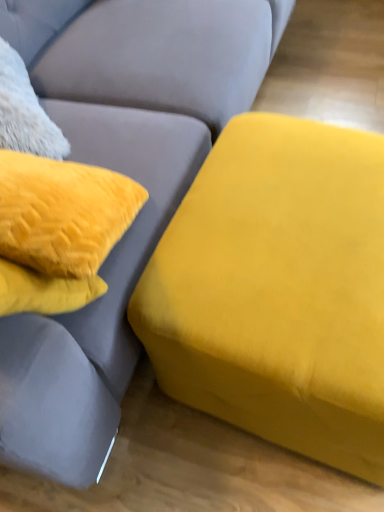
What do you see at coordinates (277, 290) in the screenshot?
I see `velvet yellow ottoman at right, positioned as the 1th studio couch in bottom-to-top order` at bounding box center [277, 290].

This screenshot has width=384, height=512. I want to click on velvet yellow ottoman at right, positioned as the 1th studio couch in bottom-to-top order, so click(x=277, y=290).

What do you see at coordinates (125, 174) in the screenshot? The height and width of the screenshot is (512, 384). I see `velvet yellow ottoman at right, marked as the 2th studio couch in a bottom-to-top arrangement` at bounding box center [125, 174].

Identify the location of velvet yellow ottoman at right, marked as the 2th studio couch in a bottom-to-top arrangement. (125, 174).

Where is `velvet yellow ottoman at right, which is the 2th studio couch in top-to-bottom order`? This screenshot has height=512, width=384. velvet yellow ottoman at right, which is the 2th studio couch in top-to-bottom order is located at coordinates (277, 290).

Between velvet yellow ottoman at right, marked as the 2th studio couch in a bottom-to-top arrangement, and velvet yellow ottoman at right, positioned as the 1th studio couch in bottom-to-top order, which one appears on the left side from the viewer's perspective?

From the viewer's perspective, velvet yellow ottoman at right, marked as the 2th studio couch in a bottom-to-top arrangement, appears more on the left side.

Who is more distant, velvet yellow ottoman at right, placed as the 1th studio couch when sorted from top to bottom, or velvet yellow ottoman at right, positioned as the 1th studio couch in bottom-to-top order?

velvet yellow ottoman at right, positioned as the 1th studio couch in bottom-to-top order, is further from the camera.

Is point (158, 186) more distant than point (265, 121)?

No, (158, 186) is closer to viewer.

From the image's perspective, is velvet yellow ottoman at right, marked as the 2th studio couch in a bottom-to-top arrangement, under velvet yellow ottoman at right, which is the 2th studio couch in top-to-bottom order?

A: Incorrect, from the image's perspective, velvet yellow ottoman at right, marked as the 2th studio couch in a bottom-to-top arrangement, is higher than velvet yellow ottoman at right, which is the 2th studio couch in top-to-bottom order.

From a real-world perspective, which object stands above the other?

In real-world perspective, velvet yellow ottoman at right, placed as the 1th studio couch when sorted from top to bottom, is above.

Considering the relative sizes of velvet yellow ottoman at right, placed as the 1th studio couch when sorted from top to bottom, and velvet yellow ottoman at right, which is the 2th studio couch in top-to-bottom order, in the image provided, is velvet yellow ottoman at right, placed as the 1th studio couch when sorted from top to bottom, thinner than velvet yellow ottoman at right, which is the 2th studio couch in top-to-bottom order,?

Incorrect, the width of velvet yellow ottoman at right, placed as the 1th studio couch when sorted from top to bottom, is not less than that of velvet yellow ottoman at right, which is the 2th studio couch in top-to-bottom order.

Between velvet yellow ottoman at right, placed as the 1th studio couch when sorted from top to bottom, and velvet yellow ottoman at right, which is the 2th studio couch in top-to-bottom order, which one has more height?

Standing taller between the two is velvet yellow ottoman at right, placed as the 1th studio couch when sorted from top to bottom.

Does velvet yellow ottoman at right, marked as the 2th studio couch in a bottom-to-top arrangement, have a larger size compared to velvet yellow ottoman at right, positioned as the 1th studio couch in bottom-to-top order?

Yes, velvet yellow ottoman at right, marked as the 2th studio couch in a bottom-to-top arrangement, is bigger than velvet yellow ottoman at right, positioned as the 1th studio couch in bottom-to-top order.

Can velvet yellow ottoman at right, positioned as the 1th studio couch in bottom-to-top order, be found inside velvet yellow ottoman at right, marked as the 2th studio couch in a bottom-to-top arrangement?

No, velvet yellow ottoman at right, positioned as the 1th studio couch in bottom-to-top order, is not inside velvet yellow ottoman at right, marked as the 2th studio couch in a bottom-to-top arrangement.

Is velvet yellow ottoman at right, marked as the 2th studio couch in a bottom-to-top arrangement, not near velvet yellow ottoman at right, positioned as the 1th studio couch in bottom-to-top order?

No.

Could you tell me if velvet yellow ottoman at right, placed as the 1th studio couch when sorted from top to bottom, is turned towards velvet yellow ottoman at right, which is the 2th studio couch in top-to-bottom order?

Yes, velvet yellow ottoman at right, placed as the 1th studio couch when sorted from top to bottom, is turned towards velvet yellow ottoman at right, which is the 2th studio couch in top-to-bottom order.

The image size is (384, 512). What are the coordinates of `studio couch below the velvet yellow ottoman at right, marked as the 2th studio couch in a bottom-to-top arrangement (from a real-world perspective)` in the screenshot? It's located at (277, 290).

Consider the image. Considering the positions of objects velvet yellow ottoman at right, which is the 2th studio couch in top-to-bottom order, and velvet yellow ottoman at right, placed as the 1th studio couch when sorted from top to bottom, in the image provided, who is more to the right, velvet yellow ottoman at right, which is the 2th studio couch in top-to-bottom order, or velvet yellow ottoman at right, placed as the 1th studio couch when sorted from top to bottom,?

From the viewer's perspective, velvet yellow ottoman at right, which is the 2th studio couch in top-to-bottom order, appears more on the right side.

Is velvet yellow ottoman at right, which is the 2th studio couch in top-to-bottom order, positioned in front of velvet yellow ottoman at right, placed as the 1th studio couch when sorted from top to bottom?

No, velvet yellow ottoman at right, which is the 2th studio couch in top-to-bottom order, is further to the viewer.

Is point (181, 221) closer or farther from the camera than point (90, 386)?

Point (181, 221) is farther from the camera than point (90, 386).

From the image's perspective, is velvet yellow ottoman at right, which is the 2th studio couch in top-to-bottom order, under velvet yellow ottoman at right, marked as the 2th studio couch in a bottom-to-top arrangement?

Yes.

From a real-world perspective, is velvet yellow ottoman at right, positioned as the 1th studio couch in bottom-to-top order, over velvet yellow ottoman at right, marked as the 2th studio couch in a bottom-to-top arrangement?

Actually, velvet yellow ottoman at right, positioned as the 1th studio couch in bottom-to-top order, is physically below velvet yellow ottoman at right, marked as the 2th studio couch in a bottom-to-top arrangement, in the real world.

Does velvet yellow ottoman at right, which is the 2th studio couch in top-to-bottom order, have a lesser width compared to velvet yellow ottoman at right, placed as the 1th studio couch when sorted from top to bottom?

Yes.

In the scene shown: Can you confirm if velvet yellow ottoman at right, positioned as the 1th studio couch in bottom-to-top order, is shorter than velvet yellow ottoman at right, placed as the 1th studio couch when sorted from top to bottom?

Yes, velvet yellow ottoman at right, positioned as the 1th studio couch in bottom-to-top order, is shorter than velvet yellow ottoman at right, placed as the 1th studio couch when sorted from top to bottom.

Considering the sizes of velvet yellow ottoman at right, which is the 2th studio couch in top-to-bottom order, and velvet yellow ottoman at right, placed as the 1th studio couch when sorted from top to bottom, in the image, is velvet yellow ottoman at right, which is the 2th studio couch in top-to-bottom order, bigger or smaller than velvet yellow ottoman at right, placed as the 1th studio couch when sorted from top to bottom,?

In the image, velvet yellow ottoman at right, which is the 2th studio couch in top-to-bottom order, appears to be smaller than velvet yellow ottoman at right, placed as the 1th studio couch when sorted from top to bottom.

Is velvet yellow ottoman at right, positioned as the 1th studio couch in bottom-to-top order, inside the boundaries of velvet yellow ottoman at right, placed as the 1th studio couch when sorted from top to bottom, or outside?

velvet yellow ottoman at right, positioned as the 1th studio couch in bottom-to-top order, is not inside velvet yellow ottoman at right, placed as the 1th studio couch when sorted from top to bottom, it's outside.

Is velvet yellow ottoman at right, positioned as the 1th studio couch in bottom-to-top order, far from velvet yellow ottoman at right, marked as the 2th studio couch in a bottom-to-top arrangement?

velvet yellow ottoman at right, positioned as the 1th studio couch in bottom-to-top order, is actually quite close to velvet yellow ottoman at right, marked as the 2th studio couch in a bottom-to-top arrangement.

Is velvet yellow ottoman at right, positioned as the 1th studio couch in bottom-to-top order, oriented away from velvet yellow ottoman at right, placed as the 1th studio couch when sorted from top to bottom?

Yes, velvet yellow ottoman at right, positioned as the 1th studio couch in bottom-to-top order, is positioned with its back facing velvet yellow ottoman at right, placed as the 1th studio couch when sorted from top to bottom.

How many degrees apart are the facing directions of velvet yellow ottoman at right, positioned as the 1th studio couch in bottom-to-top order, and velvet yellow ottoman at right, placed as the 1th studio couch when sorted from top to bottom?

They differ by 5.95 degrees in their facing directions.

You are a GUI agent. You are given a task and a screenshot of the screen. Output one action in this format:
    pyautogui.click(x=<x>, y=<y>)
    Task: Click on the studio couch located below the velvet yellow ottoman at right, marked as the 2th studio couch in a bottom-to-top arrangement (from the image's perspective)
    This screenshot has height=512, width=384.
    Given the screenshot: What is the action you would take?
    (277, 290)

The width and height of the screenshot is (384, 512). I want to click on studio couch that appears on the right of velvet yellow ottoman at right, placed as the 1th studio couch when sorted from top to bottom, so click(x=277, y=290).

Identify the location of studio couch that is above the velvet yellow ottoman at right, which is the 2th studio couch in top-to-bottom order (from a real-world perspective). The image size is (384, 512). (125, 174).